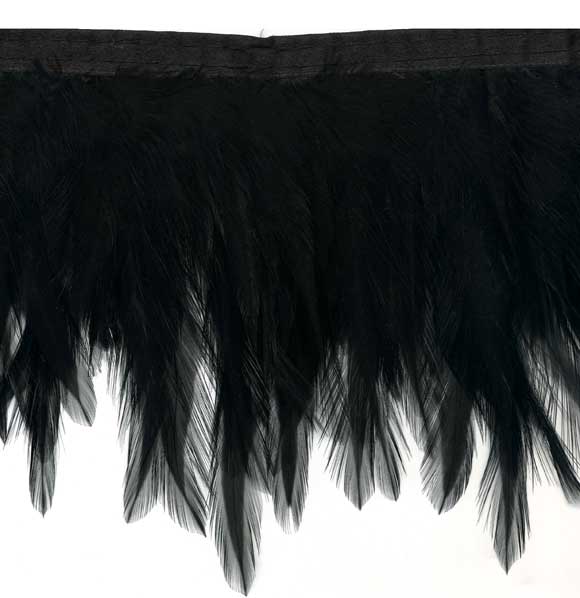
The width and height of the screenshot is (580, 598). I want to click on cracks in wood, so click(114, 57), click(232, 66), click(300, 63), click(378, 57), click(424, 56), click(472, 51), click(528, 48).